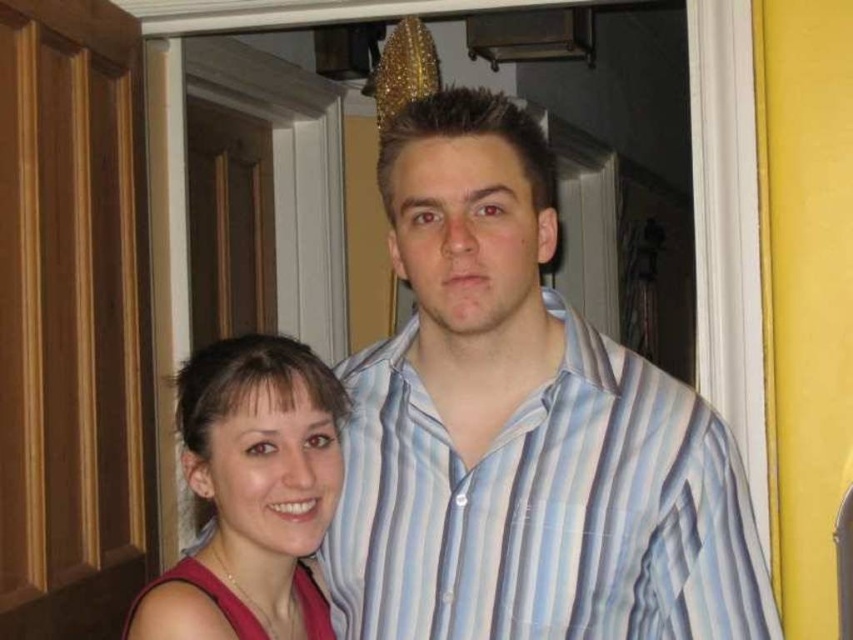
Question: Among these objects, which one is farthest from the camera?

Choices:
 (A) pink fabric dress at lower left
 (B) striped cotton shirt at center

Answer: (B)

Question: Which point is farther to the camera?

Choices:
 (A) matte pink tank top at lower left
 (B) pink fabric dress at lower left
 (C) striped cotton shirt at center

Answer: (C)

Question: Can you confirm if pink fabric dress at lower left is wider than matte pink tank top at lower left?

Choices:
 (A) yes
 (B) no

Answer: (A)

Question: From the image, what is the correct spatial relationship of striped cotton shirt at center in relation to matte pink tank top at lower left?

Choices:
 (A) right
 (B) left

Answer: (A)

Question: Does pink fabric dress at lower left have a smaller size compared to striped cotton shirt at center?

Choices:
 (A) no
 (B) yes

Answer: (A)

Question: Which is nearer to the pink fabric dress at lower left?

Choices:
 (A) striped cotton shirt at center
 (B) matte pink tank top at lower left

Answer: (A)